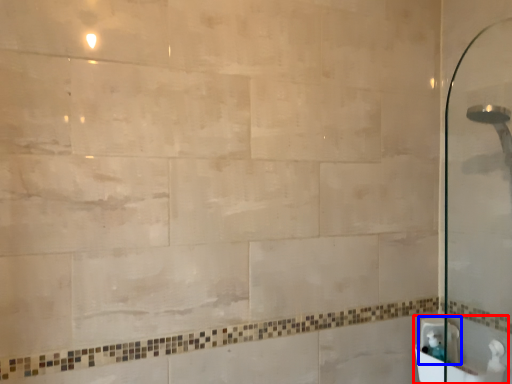
Question: Among these objects, which one is nearest to the camera, sink (highlighted by a red box) or sink (highlighted by a blue box)?

Choices:
 (A) sink
 (B) sink

Answer: (A)